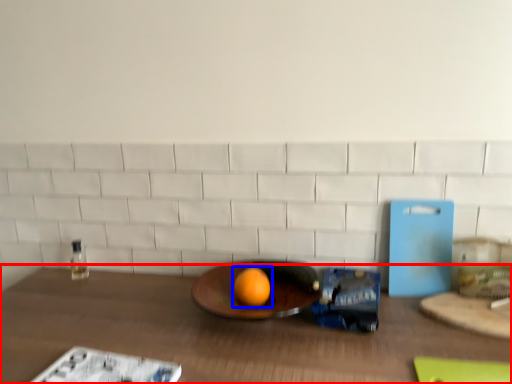
Question: Among these objects, which one is farthest to the camera, table (highlighted by a red box) or grapefruit (highlighted by a blue box)?

Choices:
 (A) table
 (B) grapefruit

Answer: (B)